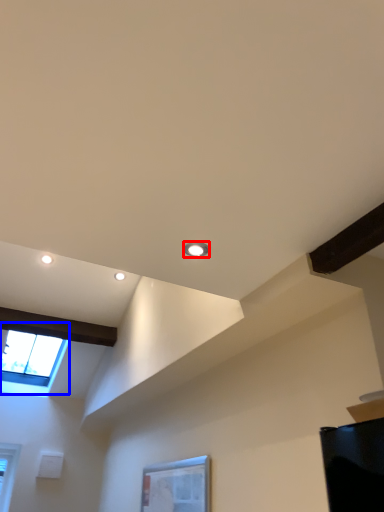
Question: Which point is closer to the camera, droplight (highlighted by a red box) or window (highlighted by a blue box)?

Choices:
 (A) droplight
 (B) window

Answer: (A)